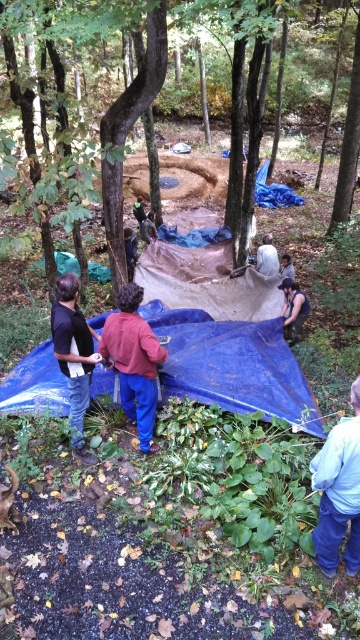
Who is more forward, (x=348, y=451) or (x=289, y=336)?

Point (x=348, y=451) is more forward.

Between blue denim jeans at lower right and dark brown leather jacket at center, which one appears on the left side from the viewer's perspective?

Positioned to the left is blue denim jeans at lower right.

Is point (334, 538) positioned behind point (288, 289)?

No, it is not.

I want to click on blue denim jeans at lower right, so click(339, 492).

Does smooth bark tree at center appear over black matte shirt at center?

Indeed, smooth bark tree at center is positioned over black matte shirt at center.

Image resolution: width=360 pixels, height=640 pixels. Find the location of `smooth bark tree at center`. smooth bark tree at center is located at coordinates (128, 132).

The image size is (360, 640). What do you see at coordinates (232, 365) in the screenshot? I see `blue tarp at center` at bounding box center [232, 365].

The width and height of the screenshot is (360, 640). Describe the element at coordinates (232, 365) in the screenshot. I see `blue tarp at center` at that location.

Find the location of a particular element. This screenshot has width=360, height=640. blue tarp at center is located at coordinates (232, 365).